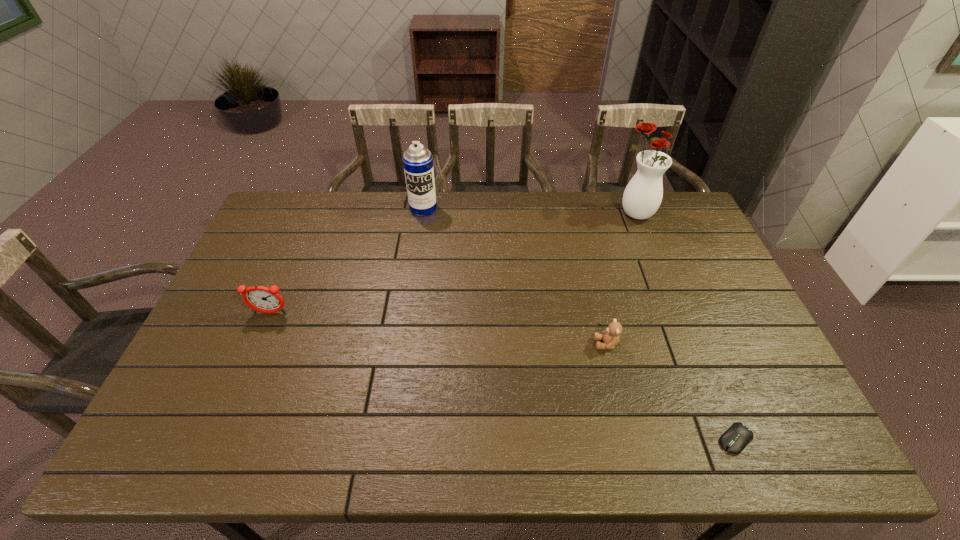
You are a GUI agent. You are given a task and a screenshot of the screen. Output one action in this format:
    pyautogui.click(x=<x>, y=<y>)
    Task: Click on the vase
    This screenshot has width=960, height=540.
    Given the screenshot: What is the action you would take?
    pyautogui.click(x=642, y=197)

Find the location of `the second object from left to right`. the second object from left to right is located at coordinates (418, 162).

Locate an element on the screen. This screenshot has width=960, height=540. the second tallest object is located at coordinates 418,162.

I want to click on the third nearest object, so click(259, 298).

Locate an element on the screen. The image size is (960, 540). alarm clock is located at coordinates (259, 298).

Find the location of a particular element. the third object from left to right is located at coordinates (610, 336).

Find the location of a particular element. The width and height of the screenshot is (960, 540). the second shortest object is located at coordinates (610, 336).

This screenshot has width=960, height=540. In order to click on the shortest object in this screenshot , I will do `click(736, 438)`.

In order to click on the nearest object in this screenshot , I will do `click(736, 438)`.

At what (x,y) coordinates should I click in order to perform the action: click on vacant space situated on the back of the vase. Please return your answer as a coordinate pair (x, y). The height and width of the screenshot is (540, 960). Looking at the image, I should click on (627, 193).